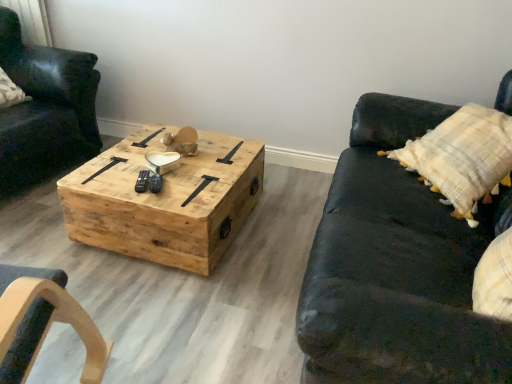
Locate an element on the screen. Image resolution: width=512 pixels, height=384 pixels. free point above natural wood coffee table at center (from a real-world perspective) is located at coordinates (167, 159).